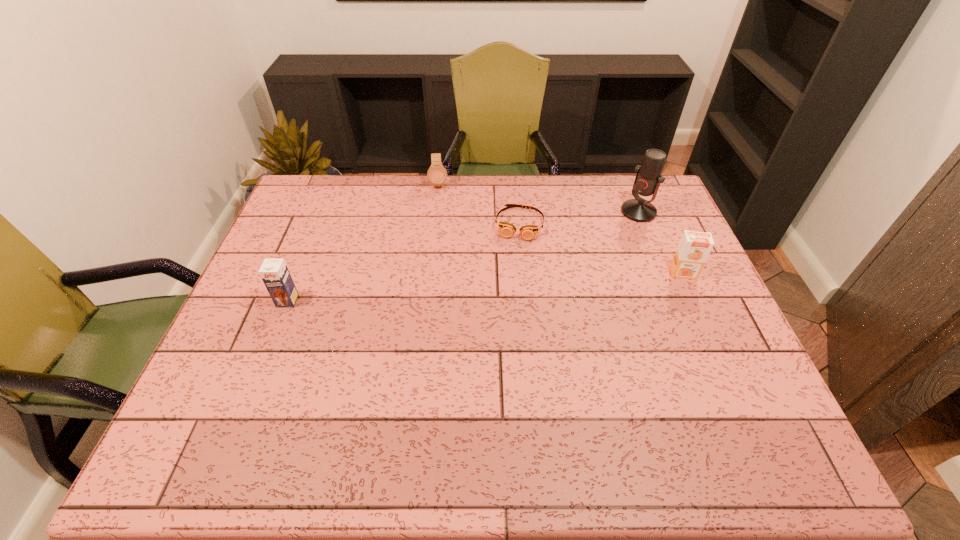
I want to click on vacant spot on the desktop that is between the leftmost object and the orange juice and is positioned on the side of the tallest object with the red ring, so click(538, 284).

Locate an element on the screen. Image resolution: width=960 pixels, height=540 pixels. vacant space on the desktop that is between the nearest object and the fourth farthest object and is positioned with the lenses facing forward on the goggles is located at coordinates (508, 285).

The width and height of the screenshot is (960, 540). I want to click on free spot on the desktop that is between the chocolate milk and the orange juice and is positioned on the face of the fourth object from right to left, so click(x=443, y=290).